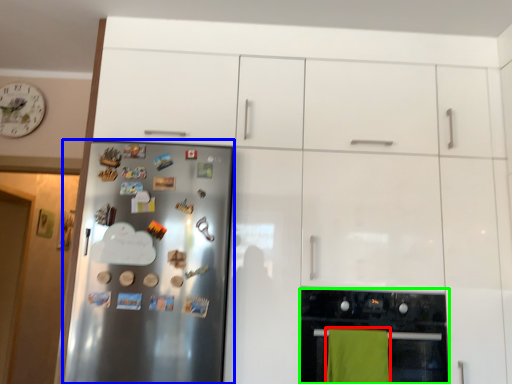
Question: Which is farther away from beach towel (highlighted by a red box)? refrigerator (highlighted by a blue box) or home appliance (highlighted by a green box)?

Choices:
 (A) refrigerator
 (B) home appliance

Answer: (A)